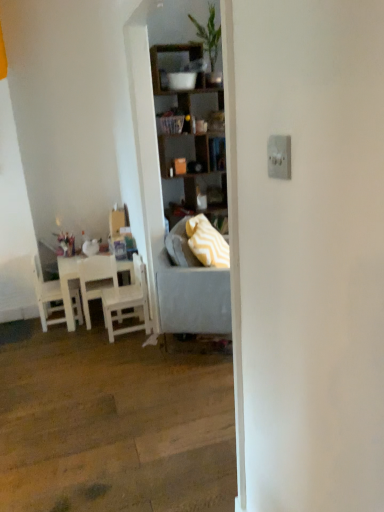
Describe the element at coordinates (48, 298) in the screenshot. I see `white wood chair at left, acting as the first chair starting from the left` at that location.

You are a GUI agent. You are given a task and a screenshot of the screen. Output one action in this format:
    pyautogui.click(x=<x>, y=<y>)
    Task: Click on the white wood chair at left, acting as the first chair starting from the left
    
    Given the screenshot: What is the action you would take?
    pyautogui.click(x=48, y=298)

Describe the element at coordinates (191, 290) in the screenshot. I see `gray fabric studio couch at center` at that location.

In order to face gray fabric studio couch at center, should I rotate leftwards or rightwards?

Rotate right and turn 1.309 degrees.

Measure the distance between wooden shelves at center and camera.

wooden shelves at center and camera are 3.19 meters apart from each other.

This screenshot has width=384, height=512. What do you see at coordinates (128, 303) in the screenshot?
I see `white wood chair at left, which is counted as the 3th chair, starting from the left` at bounding box center [128, 303].

You are a GUI agent. You are given a task and a screenshot of the screen. Output one action in this format:
    pyautogui.click(x=<x>, y=<y>)
    Task: Click on the white wood chair at left, positioned as the third chair in right-to-left order
    Image resolution: width=384 pixels, height=512 pixels.
    Given the screenshot: What is the action you would take?
    pyautogui.click(x=48, y=298)

Who is bigger, wooden shelves at center or yellow zigzag fabric pillow at center?

Bigger between the two is wooden shelves at center.

Is wooden shelves at center positioned with its back to yellow zigzag fabric pillow at center?

No, yellow zigzag fabric pillow at center is not at the back of wooden shelves at center.

From a real-world perspective, is wooden shelves at center located higher than yellow zigzag fabric pillow at center?

Yes, from a real-world perspective, wooden shelves at center is on top of yellow zigzag fabric pillow at center.

Is wooden shelves at center thinner than yellow zigzag fabric pillow at center?

In fact, wooden shelves at center might be wider than yellow zigzag fabric pillow at center.

Is wooden shelves at center positioned beyond the bounds of gray fabric studio couch at center?

Yes, wooden shelves at center is not within gray fabric studio couch at center.

Measure the distance from wooden shelves at center to gray fabric studio couch at center.

A distance of 3.37 feet exists between wooden shelves at center and gray fabric studio couch at center.

Is wooden shelves at center smaller than gray fabric studio couch at center?

No.

Does wooden shelves at center have a lesser width compared to gray fabric studio couch at center?

Correct, the width of wooden shelves at center is less than that of gray fabric studio couch at center.

Where is `pillow that appears above the white wood chair at left, the first chair when ordered from right to left (from the image's perspective)`? This screenshot has height=512, width=384. pillow that appears above the white wood chair at left, the first chair when ordered from right to left (from the image's perspective) is located at coordinates (207, 242).

Is yellow zigzag fabric pillow at center at the back of white wood chair at left, the first chair when ordered from right to left?

Correct, white wood chair at left, the first chair when ordered from right to left, is looking away from yellow zigzag fabric pillow at center.

Between white wood chair at left, which is counted as the 3th chair, starting from the left, and yellow zigzag fabric pillow at center, which one has smaller width?

With smaller width is yellow zigzag fabric pillow at center.

How many degrees apart are the facing directions of white wood chair at left, positioned as the third chair in right-to-left order, and yellow zigzag fabric pillow at center?

There is a 30.1-degree angle between the facing directions of white wood chair at left, positioned as the third chair in right-to-left order, and yellow zigzag fabric pillow at center.

From the image's perspective, which one is positioned lower, white wood chair at left, acting as the first chair starting from the left, or yellow zigzag fabric pillow at center?

From the image's view, white wood chair at left, acting as the first chair starting from the left, is below.

From a real-world perspective, who is located lower, white wood chair at left, acting as the first chair starting from the left, or yellow zigzag fabric pillow at center?

In real-world perspective, white wood chair at left, acting as the first chair starting from the left, is lower.

Looking at this image, considering the sizes of objects white wood chair at left, acting as the first chair starting from the left, and yellow zigzag fabric pillow at center in the image provided, who is shorter, white wood chair at left, acting as the first chair starting from the left, or yellow zigzag fabric pillow at center?

With less height is yellow zigzag fabric pillow at center.

From a real-world perspective, does white matte table at left stand above white matte chair at left, placed as the 2th chair when sorted from right to left?

No, from a real-world perspective, white matte table at left is not above white matte chair at left, placed as the 2th chair when sorted from right to left.

How different are the orientations of white matte table at left and white matte chair at left, placed as the 2th chair when sorted from right to left, in degrees?

The angle between the facing direction of white matte table at left and the facing direction of white matte chair at left, placed as the 2th chair when sorted from right to left, is 90.1 degrees.

Is white matte table at left to the right of white matte chair at left, placed as the 2th chair when sorted from right to left, from the viewer's perspective?

No.

Is white matte table at left not close to white matte chair at left, which ranks as the 2th chair in left-to-right order?

white matte table at left is actually quite close to white matte chair at left, which ranks as the 2th chair in left-to-right order.

There is a gray fabric studio couch at center. Where is `pillow above it (from a real-world perspective)`? The width and height of the screenshot is (384, 512). pillow above it (from a real-world perspective) is located at coordinates (207, 242).

Which object is closer to the camera, yellow zigzag fabric pillow at center or gray fabric studio couch at center?

gray fabric studio couch at center is closer to the camera.

Does yellow zigzag fabric pillow at center touch gray fabric studio couch at center?

No, yellow zigzag fabric pillow at center is not with gray fabric studio couch at center.

Which point is more distant from viewer, (167,261) or (86,290)?

The point (86,290) is more distant.

Looking at this image, is gray fabric studio couch at center taller or shorter than white matte chair at left, which ranks as the 2th chair in left-to-right order?

Considering their sizes, gray fabric studio couch at center has more height than white matte chair at left, which ranks as the 2th chair in left-to-right order.

Is gray fabric studio couch at center positioned beyond the bounds of white matte chair at left, which ranks as the 2th chair in left-to-right order?

That's correct, gray fabric studio couch at center is outside of white matte chair at left, which ranks as the 2th chair in left-to-right order.

Is gray fabric studio couch at center positioned with its back to white matte chair at left, placed as the 2th chair when sorted from right to left?

Yes, gray fabric studio couch at center is facing away from white matte chair at left, placed as the 2th chair when sorted from right to left.

Locate an element on the screen. cabinetry above the yellow zigzag fabric pillow at center (from the image's perspective) is located at coordinates (191, 136).

The width and height of the screenshot is (384, 512). Find the location of `cabinetry on the left of the gray fabric studio couch at center`. cabinetry on the left of the gray fabric studio couch at center is located at coordinates (191, 136).

Considering their positions, is white wood chair at left, positioned as the third chair in right-to-left order, positioned closer to white wood chair at left, which is counted as the 3th chair, starting from the left, than white matte table at left?

white matte table at left.

Based on their spatial positions, is gray fabric studio couch at center or white wood chair at left, positioned as the third chair in right-to-left order, further from white matte table at left?

Based on the image, gray fabric studio couch at center appears to be further to white matte table at left.

Considering their positions, is gray fabric studio couch at center positioned closer to white wood chair at left, the first chair when ordered from right to left, than white matte table at left?

white matte table at left.

Looking at the image, which one is located further to white wood chair at left, acting as the first chair starting from the left, gray fabric studio couch at center or white matte chair at left, which ranks as the 2th chair in left-to-right order?

gray fabric studio couch at center is positioned further to the anchor white wood chair at left, acting as the first chair starting from the left.

Based on their spatial positions, is wooden shelves at center or white matte chair at left, placed as the 2th chair when sorted from right to left, further from white matte table at left?

Among the two, wooden shelves at center is located further to white matte table at left.

Based on their spatial positions, is white matte chair at left, which ranks as the 2th chair in left-to-right order, or wooden shelves at center further from yellow zigzag fabric pillow at center?

wooden shelves at center is positioned further to the anchor yellow zigzag fabric pillow at center.

When comparing their distances from white wood chair at left, which is counted as the 3th chair, starting from the left, does wooden shelves at center or gray fabric studio couch at center seem further?

wooden shelves at center is positioned further to the anchor white wood chair at left, which is counted as the 3th chair, starting from the left.

Considering their positions, is white matte table at left positioned further to white wood chair at left, the first chair when ordered from right to left, than yellow zigzag fabric pillow at center?

yellow zigzag fabric pillow at center is further to white wood chair at left, the first chair when ordered from right to left.

The image size is (384, 512). I want to click on chair located between white matte chair at left, placed as the 2th chair when sorted from right to left, and yellow zigzag fabric pillow at center in the left-right direction, so click(128, 303).

Image resolution: width=384 pixels, height=512 pixels. I want to click on chair located between white matte table at left and white wood chair at left, the first chair when ordered from right to left, in the left-right direction, so click(96, 280).

You are a GUI agent. You are given a task and a screenshot of the screen. Output one action in this format:
    pyautogui.click(x=<x>, y=<y>)
    Task: Click on the studio couch between white matte table at left and yellow zigzag fabric pillow at center in the horizontal direction
    
    Given the screenshot: What is the action you would take?
    pyautogui.click(x=191, y=290)

Image resolution: width=384 pixels, height=512 pixels. I want to click on studio couch that lies between wooden shelves at center and white wood chair at left, the first chair when ordered from right to left, from top to bottom, so click(x=191, y=290).